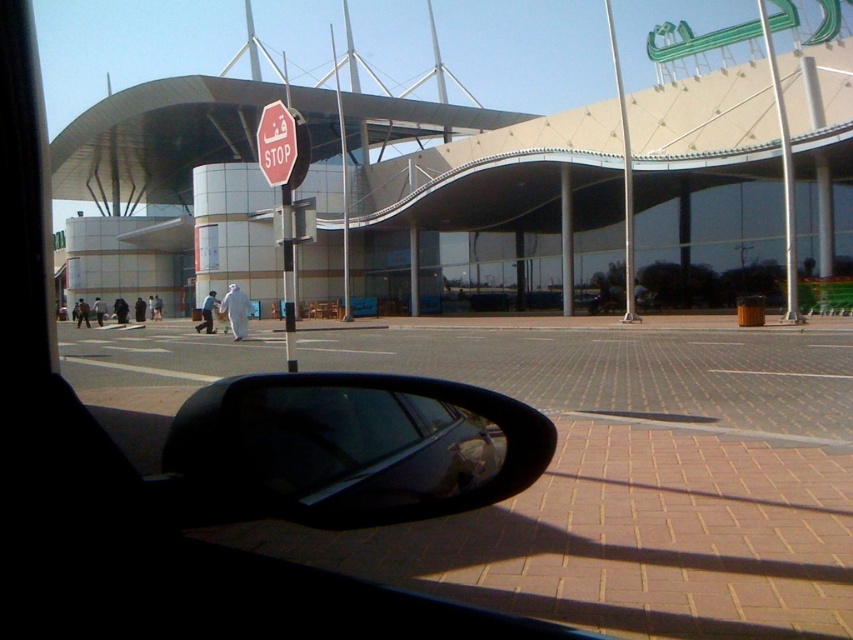
You are a passenger in a car and want to check the metallic pole at center in the rearview mirror. Which side mirror should you look at? The black glossy side mirror at lower left or the other side mirror not shown?

You should look at the black glossy side mirror at lower left because it is to the left of the metallic pole at center, so it would reflect the pole.

You are a pedestrian standing on the sidewalk and see the metallic pole at upper right and the red matte stop sign at center. Which object is closer to you?

The metallic pole at upper right is closer to you because it is further to the viewer than the red matte stop sign at center.

You are a driver navigating through the city and need to locate the metallic pole at upper right in the scene. Based on the coordinates provided, where would you expect to find it in the image?

The metallic pole at upper right is located at the 2D coordinates point (782,173) in the image.